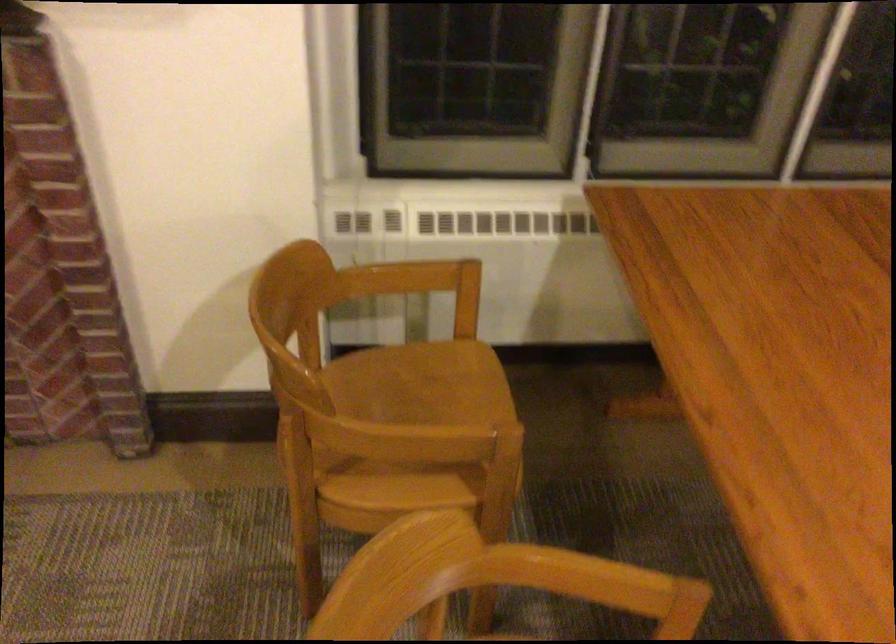
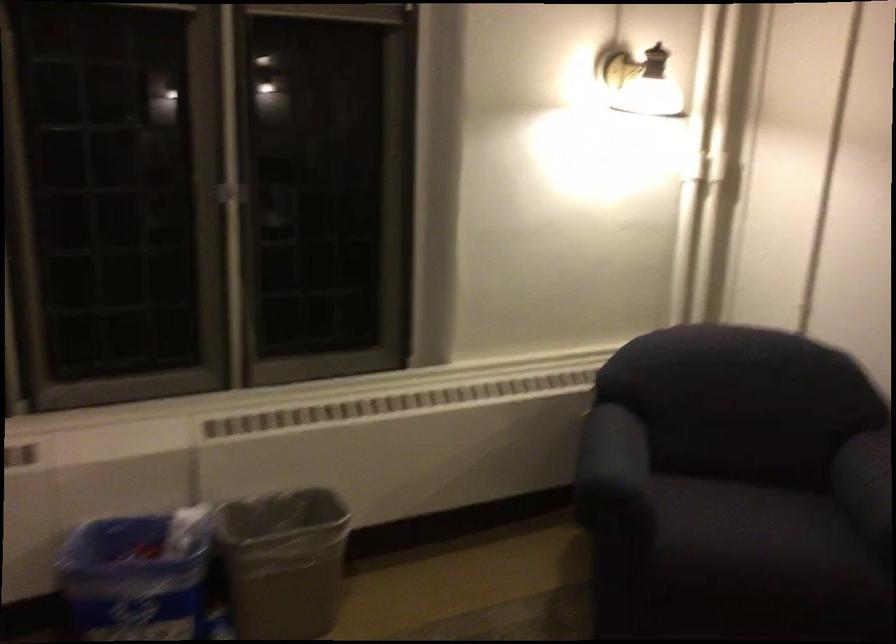
The first image is from the beginning of the video and the second image is from the end. How did the camera likely rotate when shooting the video?

The camera rotated toward right-down.